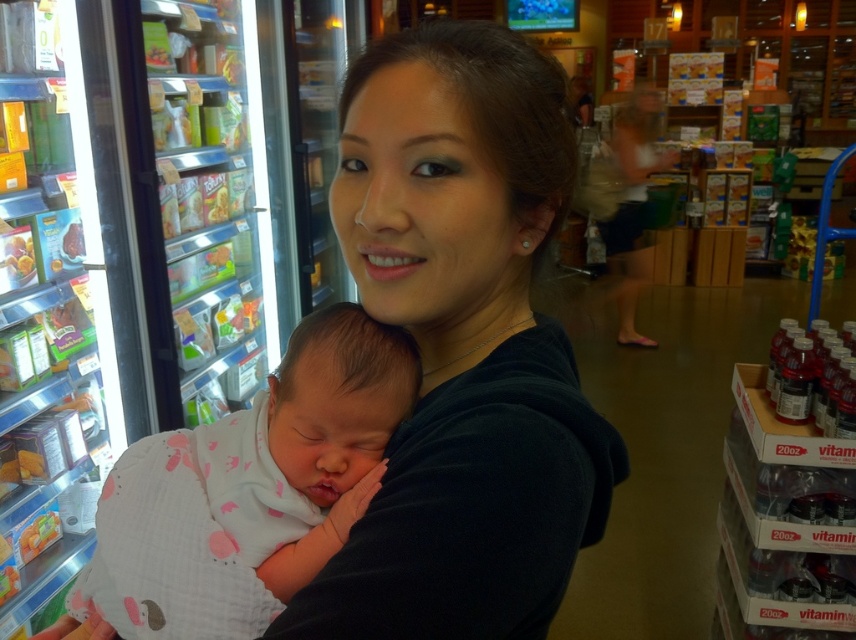
Question: Is black matte shirt at center to the right of white cotton swaddle at center from the viewer's perspective?

Choices:
 (A) no
 (B) yes

Answer: (B)

Question: Does black matte shirt at center appear on the right side of white cotton swaddle at center?

Choices:
 (A) no
 (B) yes

Answer: (B)

Question: Which point is farther to the camera?

Choices:
 (A) white cotton swaddle at center
 (B) black matte shirt at center

Answer: (A)

Question: Which point is farther to the camera?

Choices:
 (A) (319, 561)
 (B) (324, 568)

Answer: (A)

Question: Does black matte shirt at center appear on the left side of white cotton swaddle at center?

Choices:
 (A) yes
 (B) no

Answer: (B)